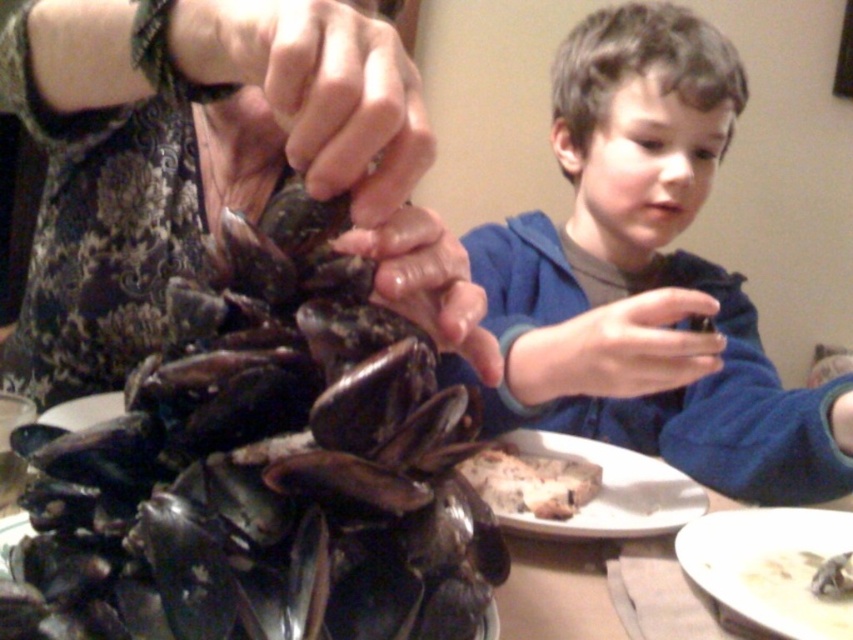
Does blue fleece jacket at center have a smaller size compared to dark brown wooden platter at center?

No.

Is point (848, 401) positioned after point (602, 522)?

Yes, it is.

I want to click on blue fleece jacket at center, so click(648, 276).

Is shiny dark shell at center shorter than dark brown wooden platter at center?

No.

Can you confirm if shiny dark shell at center is positioned to the right of dark brown wooden platter at center?

In fact, shiny dark shell at center is to the left of dark brown wooden platter at center.

Where is `shiny dark shell at center`? This screenshot has height=640, width=853. shiny dark shell at center is located at coordinates (218, 172).

Where is `shiny dark shell at center`? The width and height of the screenshot is (853, 640). shiny dark shell at center is located at coordinates (218, 172).

How distant is shiny dark shell at center from blue fleece jacket at center?

A distance of 11.00 inches exists between shiny dark shell at center and blue fleece jacket at center.

Does shiny dark shell at center have a greater width compared to blue fleece jacket at center?

Yes, shiny dark shell at center is wider than blue fleece jacket at center.

What do you see at coordinates (218, 172) in the screenshot? Image resolution: width=853 pixels, height=640 pixels. I see `shiny dark shell at center` at bounding box center [218, 172].

The image size is (853, 640). Find the location of `shiny dark shell at center`. shiny dark shell at center is located at coordinates (218, 172).